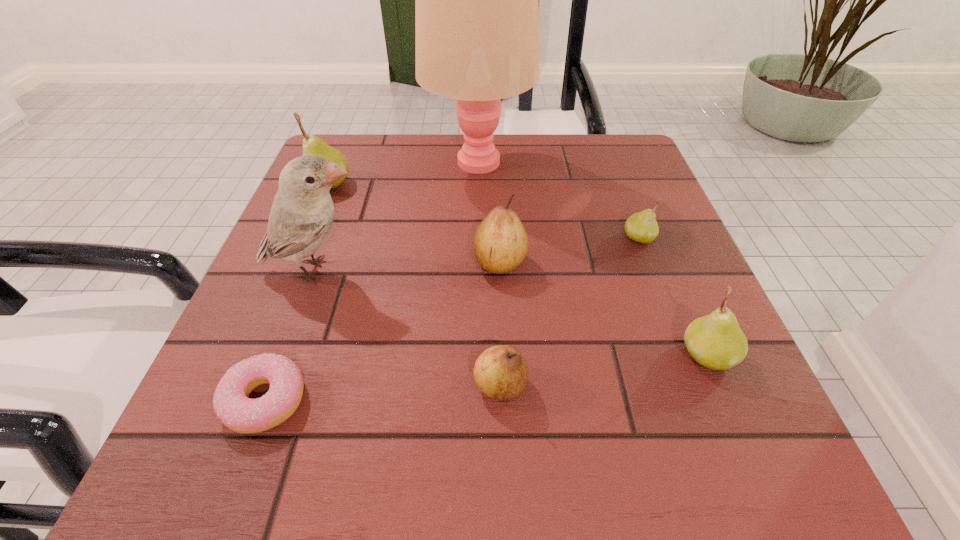
The image size is (960, 540). I want to click on pink doughnut, so click(x=231, y=403).

At what (x,y) coordinates should I click in order to perform the action: click on doughnut. Please return your answer as a coordinate pair (x, y). Image resolution: width=960 pixels, height=540 pixels. Looking at the image, I should click on (231, 403).

Identify the location of vacant space located 0.210m on the left of the pink lampshade. (334, 163).

This screenshot has width=960, height=540. Find the location of `free point located 0.080m at the face of the bird`. free point located 0.080m at the face of the bird is located at coordinates (417, 270).

Locate an element on the screen. free space located 0.090m on the front of the leftmost green pear is located at coordinates (311, 225).

Identify the location of free space located on the left of the bigger brown pear. This screenshot has height=540, width=960. (351, 262).

Identify the location of vacant region located 0.370m on the left of the second smallest green pear. This screenshot has height=540, width=960. (432, 355).

The width and height of the screenshot is (960, 540). Find the location of `free space located 0.140m on the back of the smallest green pear`. free space located 0.140m on the back of the smallest green pear is located at coordinates (619, 186).

The image size is (960, 540). I want to click on free spot located 0.060m on the back of the nearer brown pear, so click(498, 330).

This screenshot has width=960, height=540. In order to click on free space located on the right of the shortest object in this screenshot , I will do 540,400.